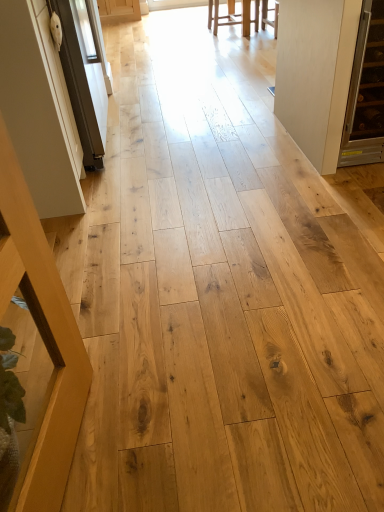
What is the approximate width of white matte door at right?

It is 1.41 meters.

Measure the distance between natural wood table at left, which is the second furniture from back to front, and camera.

A distance of 30.60 inches exists between natural wood table at left, which is the second furniture from back to front, and camera.

I want to click on light brown wood stool at upper center, the second furniture positioned from the bottom, so click(x=233, y=17).

What do you see at coordinates (85, 75) in the screenshot?
I see `white glossy screen door at left` at bounding box center [85, 75].

The image size is (384, 512). What are the coordinates of `white matte door at right` in the screenshot? It's located at (307, 72).

Which is less distant, (243, 1) or (317, 76)?

Point (243, 1) is farther from the camera than point (317, 76).

Which is in front, light brown wood stool at upper center, the first furniture positioned from the top, or white matte door at right?

white matte door at right.

Can you confirm if light brown wood stool at upper center, which is the 2th furniture in front-to-back order, is thinner than white matte door at right?

Correct, the width of light brown wood stool at upper center, which is the 2th furniture in front-to-back order, is less than that of white matte door at right.

Can you confirm if light brown wood stool at upper center, which ranks as the first furniture in back-to-front order, is taller than white matte door at right?

In fact, light brown wood stool at upper center, which ranks as the first furniture in back-to-front order, may be shorter than white matte door at right.

Does light brown wood stool at upper center, the 2th furniture in the left-to-right sequence, lie behind natural wood table at left, which is counted as the first furniture, starting from the front?

Yes, it is behind natural wood table at left, which is counted as the first furniture, starting from the front.

Based on the photo, between light brown wood stool at upper center, the second furniture positioned from the bottom, and natural wood table at left, which appears as the first furniture when ordered from the bottom, which one has more height?

natural wood table at left, which appears as the first furniture when ordered from the bottom.

Based on the photo, from the image's perspective, is light brown wood stool at upper center, acting as the first furniture starting from the right, below natural wood table at left, which ranks as the first furniture in left-to-right order?

Incorrect, from the image's perspective, light brown wood stool at upper center, acting as the first furniture starting from the right, is higher than natural wood table at left, which ranks as the first furniture in left-to-right order.

I want to click on furniture below the light brown wood stool at upper center, which is the 2th furniture in front-to-back order (from the image's perspective), so click(x=42, y=339).

Does point (280, 79) appear closer or farther from the camera than point (76, 77)?

Point (280, 79).

Which object is thinner, white matte door at right or white glossy screen door at left?

white glossy screen door at left is thinner.

Can you tell me how much white matte door at right and white glossy screen door at left differ in facing direction?

90.4 degrees.

In terms of height, does white matte door at right look taller or shorter compared to white glossy screen door at left?

In the image, white matte door at right appears to be shorter than white glossy screen door at left.

Does natural wood table at left, which ranks as the 2th furniture in right-to-left order, appear on the left side of white matte door at right?

Correct, you'll find natural wood table at left, which ranks as the 2th furniture in right-to-left order, to the left of white matte door at right.

Which of these two, natural wood table at left, which is the second furniture from back to front, or white matte door at right, is wider?

white matte door at right is wider.

Measure the distance between natural wood table at left, which ranks as the 2th furniture in right-to-left order, and white matte door at right.

natural wood table at left, which ranks as the 2th furniture in right-to-left order, is 1.78 meters away from white matte door at right.

Considering the points (5, 200) and (306, 45), which point is behind, point (5, 200) or point (306, 45)?

Positioned behind is point (306, 45).

From the image's perspective, is natural wood table at left, which appears as the first furniture when ordered from the bottom, below white glossy screen door at left?

Yes, from the image's perspective, natural wood table at left, which appears as the first furniture when ordered from the bottom, is beneath white glossy screen door at left.

Is natural wood table at left, which appears as the first furniture when ordered from the bottom, facing towards white glossy screen door at left?

No, natural wood table at left, which appears as the first furniture when ordered from the bottom, is not facing towards white glossy screen door at left.

In the scene shown: From a real-world perspective, between natural wood table at left, which ranks as the first furniture in left-to-right order, and white glossy screen door at left, who is vertically higher?

In real-world perspective, natural wood table at left, which ranks as the first furniture in left-to-right order, is above.

Is natural wood table at left, marked as the 2th furniture in a top-to-bottom arrangement, at the right side of white glossy screen door at left?

Yes.

Which is further, (x=92, y=162) or (x=14, y=237)?

The point (x=92, y=162) is farther from the camera.

From a real-world perspective, is white glossy screen door at left located higher than natural wood table at left, which ranks as the first furniture in left-to-right order?

Actually, white glossy screen door at left is physically below natural wood table at left, which ranks as the first furniture in left-to-right order, in the real world.

What are the coordinates of `furniture that appears in front of the white glossy screen door at left` in the screenshot? It's located at pyautogui.click(x=42, y=339).

Would you say natural wood table at left, which ranks as the 2th furniture in right-to-left order, is part of white glossy screen door at left's contents?

No, white glossy screen door at left does not contain natural wood table at left, which ranks as the 2th furniture in right-to-left order.

Can you confirm if white matte door at right is positioned to the left of natural wood table at left, marked as the 2th furniture in a top-to-bottom arrangement?

No.

From a real-world perspective, is white matte door at right above or below natural wood table at left, which ranks as the 2th furniture in right-to-left order?

In terms of real-world spatial position, white matte door at right is below natural wood table at left, which ranks as the 2th furniture in right-to-left order.

Choose the correct answer: Is white matte door at right inside natural wood table at left, which is the second furniture from back to front, or outside it?

white matte door at right is not enclosed by natural wood table at left, which is the second furniture from back to front.

Who is smaller, white matte door at right or natural wood table at left, which is the second furniture from back to front?

Smaller between the two is natural wood table at left, which is the second furniture from back to front.

The height and width of the screenshot is (512, 384). In order to click on door on the right of light brown wood stool at upper center, the second furniture positioned from the bottom in this screenshot , I will do `click(307, 72)`.

This screenshot has height=512, width=384. I want to click on furniture behind the natural wood table at left, marked as the 2th furniture in a top-to-bottom arrangement, so click(233, 17).

In the scene shown: From the image, which object appears to be nearer to white glossy screen door at left, white matte door at right or natural wood table at left, which ranks as the 2th furniture in right-to-left order?

white matte door at right lies closer to white glossy screen door at left than the other object.

Which object lies nearer to the anchor point white matte door at right, white glossy screen door at left or natural wood table at left, marked as the 2th furniture in a top-to-bottom arrangement?

Based on the image, white glossy screen door at left appears to be nearer to white matte door at right.

Based on their spatial positions, is natural wood table at left, which is counted as the first furniture, starting from the front, or white glossy screen door at left further from white matte door at right?

natural wood table at left, which is counted as the first furniture, starting from the front, is positioned further to the anchor white matte door at right.

Which object lies further to the anchor point white glossy screen door at left, natural wood table at left, which ranks as the 2th furniture in right-to-left order, or white matte door at right?

natural wood table at left, which ranks as the 2th furniture in right-to-left order, is positioned further to the anchor white glossy screen door at left.

When comparing their distances from natural wood table at left, marked as the 2th furniture in a top-to-bottom arrangement, does light brown wood stool at upper center, the first furniture positioned from the top, or white matte door at right seem further?

light brown wood stool at upper center, the first furniture positioned from the top, lies further to natural wood table at left, marked as the 2th furniture in a top-to-bottom arrangement, than the other object.

Looking at the image, which one is located closer to white matte door at right, white glossy screen door at left or light brown wood stool at upper center, acting as the first furniture starting from the right?

white glossy screen door at left is closer to white matte door at right.

From the picture: When comparing their distances from natural wood table at left, which is the second furniture from back to front, does white glossy screen door at left or white matte door at right seem closer?

white glossy screen door at left.

Consider the image. Based on their spatial positions, is light brown wood stool at upper center, which is the 2th furniture in front-to-back order, or white glossy screen door at left further from natural wood table at left, marked as the 2th furniture in a top-to-bottom arrangement?

light brown wood stool at upper center, which is the 2th furniture in front-to-back order.

Image resolution: width=384 pixels, height=512 pixels. In order to click on screen door between natural wood table at left, which ranks as the 2th furniture in right-to-left order, and light brown wood stool at upper center, the second furniture positioned from the bottom, in the front-back direction in this screenshot , I will do `click(85, 75)`.

Identify the location of screen door between white matte door at right and light brown wood stool at upper center, which ranks as the first furniture in back-to-front order, along the z-axis. (85, 75).

At what (x,y) coordinates should I click in order to perform the action: click on door between natural wood table at left, marked as the 2th furniture in a top-to-bottom arrangement, and light brown wood stool at upper center, which ranks as the first furniture in back-to-front order, in the front-back direction. Please return your answer as a coordinate pair (x, y). Image resolution: width=384 pixels, height=512 pixels. Looking at the image, I should click on [307, 72].